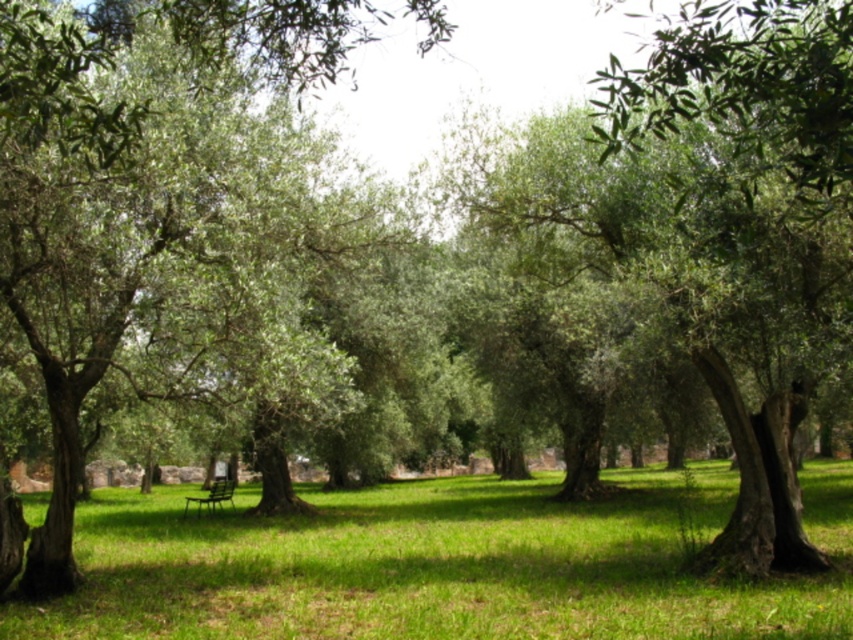
Does green grassy field at center have a larger size compared to metallic green bench at center?

Correct, green grassy field at center is larger in size than metallic green bench at center.

Can you confirm if green grassy field at center is taller than metallic green bench at center?

Yes.

Does point (747, 625) come in front of point (213, 477)?

Yes.

Locate an element on the screen. green grassy field at center is located at coordinates (442, 566).